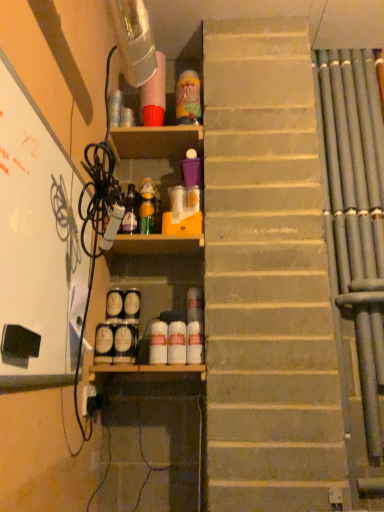
Question: Could you tell me if white matte bulletin board at left is facing white glossy bottle at center, which is the second bottle from right to left?

Choices:
 (A) no
 (B) yes

Answer: (A)

Question: Can you confirm if white matte bulletin board at left is smaller than white glossy bottle at center, which is the fourth bottle from top to bottom?

Choices:
 (A) yes
 (B) no

Answer: (B)

Question: Is white glossy bottle at center, marked as the 4th bottle in a left-to-right arrangement, at the back of white matte bulletin board at left?

Choices:
 (A) yes
 (B) no

Answer: (B)

Question: From a real-world perspective, does white matte bulletin board at left sit lower than white glossy bottle at center, the 2th bottle in the bottom-to-top sequence?

Choices:
 (A) no
 (B) yes

Answer: (A)

Question: Is white matte bulletin board at left next to white glossy bottle at center, which is the fourth bottle from top to bottom?

Choices:
 (A) no
 (B) yes

Answer: (A)

Question: From their relative heights in the image, would you say translucent plastic bottle at upper center, the fifth bottle when ordered from bottom to top, is taller or shorter than white matte bottle at center, which is the third bottle in right-to-left order?

Choices:
 (A) short
 (B) tall

Answer: (B)

Question: Is translucent plastic bottle at upper center, marked as the fifth bottle in a left-to-right arrangement, inside the boundaries of white matte bottle at center, the 1th bottle from the bottom, or outside?

Choices:
 (A) inside
 (B) outside

Answer: (B)

Question: In terms of width, does translucent plastic bottle at upper center, the 1th bottle when ordered from right to left, look wider or thinner when compared to white matte bottle at center, the 1th bottle from the bottom?

Choices:
 (A) wide
 (B) thin

Answer: (A)

Question: Based on their sizes in the image, would you say translucent plastic bottle at upper center, marked as the fifth bottle in a left-to-right arrangement, is bigger or smaller than white matte bottle at center, the 5th bottle positioned from the top?

Choices:
 (A) big
 (B) small

Answer: (A)

Question: Considering the positions of point (130, 192) and point (13, 318), is point (130, 192) closer or farther from the camera than point (13, 318)?

Choices:
 (A) closer
 (B) farther

Answer: (B)

Question: Is matte glass bottle at center, marked as the first bottle in a left-to-right arrangement, spatially inside white matte bulletin board at left, or outside of it?

Choices:
 (A) inside
 (B) outside

Answer: (B)

Question: Relative to white matte bulletin board at left, is matte glass bottle at center, acting as the 5th bottle starting from the right, in front or behind?

Choices:
 (A) front
 (B) behind

Answer: (B)

Question: Is matte glass bottle at center, the fourth bottle from the bottom, taller or shorter than white matte bulletin board at left?

Choices:
 (A) tall
 (B) short

Answer: (B)

Question: Is translucent plastic bottle at upper center, arranged as the 1th bottle when viewed from the top, taller or shorter than white glossy bottle at center, which is the fourth bottle from top to bottom?

Choices:
 (A) tall
 (B) short

Answer: (A)

Question: In terms of width, does translucent plastic bottle at upper center, the 1th bottle when ordered from right to left, look wider or thinner when compared to white glossy bottle at center, which is the fourth bottle from top to bottom?

Choices:
 (A) wide
 (B) thin

Answer: (A)